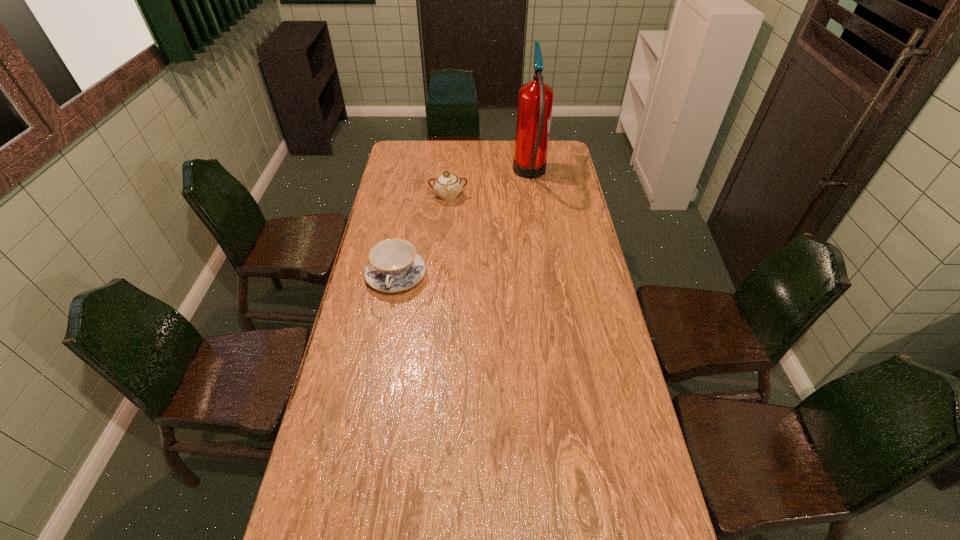
Locate an element on the screen. This screenshot has height=540, width=960. the tallest object is located at coordinates (535, 99).

Identify the location of fire extinguisher. The width and height of the screenshot is (960, 540). (535, 99).

Locate an element on the screen. The height and width of the screenshot is (540, 960). the second shortest object is located at coordinates (447, 186).

I want to click on the farther chinaware, so click(447, 186).

The height and width of the screenshot is (540, 960). I want to click on the shortest object, so [393, 266].

Locate an element on the screen. The image size is (960, 540). the nearer chinaware is located at coordinates (393, 266).

This screenshot has width=960, height=540. Find the location of `vacant space situated 0.340m on the front of the fire extinguisher`. vacant space situated 0.340m on the front of the fire extinguisher is located at coordinates (540, 251).

Identify the location of vacant area situated on the back of the farther chinaware. The height and width of the screenshot is (540, 960). (452, 155).

This screenshot has width=960, height=540. Identify the location of vacant space located with the handle on the side of the nearest object. (383, 348).

The width and height of the screenshot is (960, 540). What are the coordinates of `object situated at the far edge` in the screenshot? It's located at (535, 99).